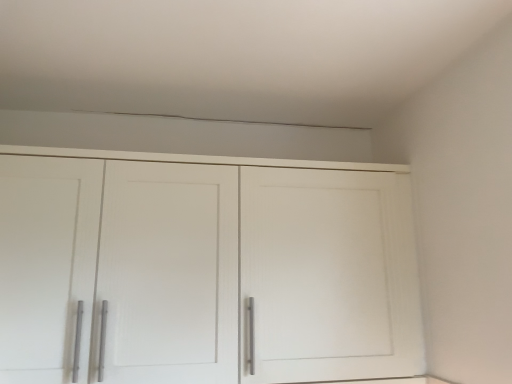
Locate an element on the screen. white matte cabinet at center is located at coordinates (205, 269).

The image size is (512, 384). Describe the element at coordinates (205, 269) in the screenshot. I see `white matte cabinet at center` at that location.

Identify the location of white matte cabinet at center. The height and width of the screenshot is (384, 512). (205, 269).